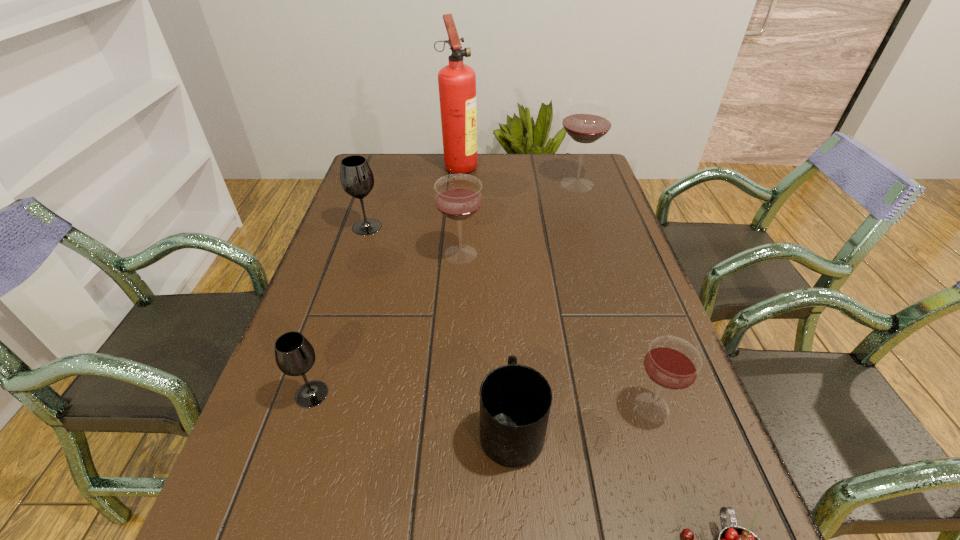
Find the location of a particular element. The image size is (960, 540). free area in between the third wineglass from right to left and the farther gray wineglass is located at coordinates (414, 240).

Find the location of a particular element. This screenshot has height=540, width=960. object that stands as the closest to the mug is located at coordinates (672, 363).

Locate an element on the screen. The height and width of the screenshot is (540, 960). object that can be found as the fifth closest to the smallest red wineglass is located at coordinates (587, 119).

You are a GUI agent. You are given a task and a screenshot of the screen. Output one action in this format:
    pyautogui.click(x=<x>, y=<y>)
    Task: Click on the fourth closest wineglass relative to the smaller gray wineglass
    The height and width of the screenshot is (540, 960).
    Given the screenshot: What is the action you would take?
    pyautogui.click(x=587, y=119)

Identify which wineglass is located as the fifth nearest to the tallest object. Please provide its 2D coordinates. Your answer should be formatted as a tuple, i.e. [(x, y)], where the tuple contains the x and y coordinates of a point satisfying the conditions above.

[(672, 363)]

Select which red wineglass is the third closest to the farther gray wineglass. Please provide its 2D coordinates. Your answer should be formatted as a tuple, i.e. [(x, y)], where the tuple contains the x and y coordinates of a point satisfying the conditions above.

[(672, 363)]

You are a GUI agent. You are given a task and a screenshot of the screen. Output one action in this format:
    pyautogui.click(x=<x>, y=<y>)
    Task: Click on the red wineglass identified as the second closest to the fire extinguisher
    
    Given the screenshot: What is the action you would take?
    pyautogui.click(x=458, y=197)

Locate an element on the screen. free space that satisfies the following two spatial constraints: 1. on the front-facing side of the fire extinguisher; 2. on the left side of the leftmost red wineglass is located at coordinates point(454,254).

Locate an element on the screen. The image size is (960, 540). vacant space that satisfies the following two spatial constraints: 1. on the side of the tallest wineglass with the handle; 2. on the right side of the black mug is located at coordinates (497, 184).